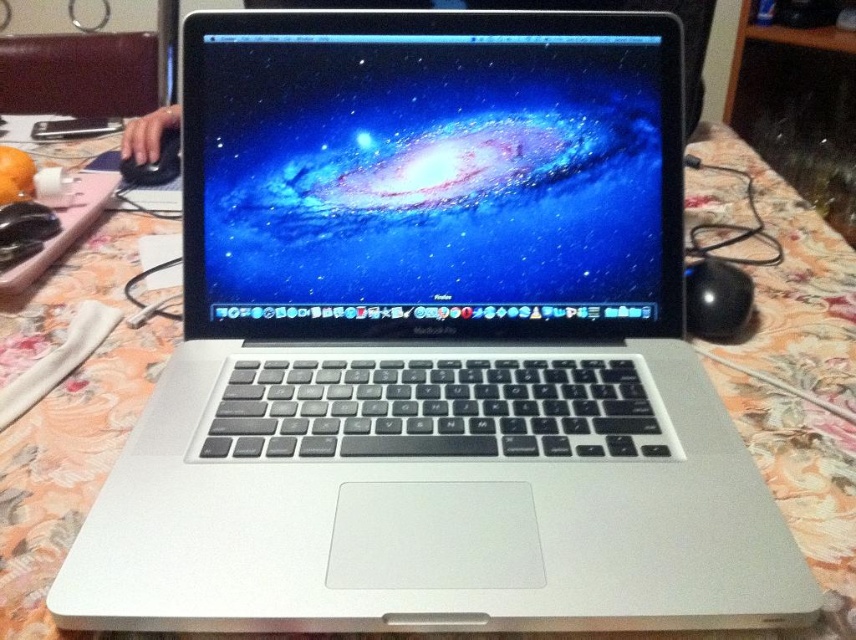
Which is more to the right, brown leather couch at upper left or black matte mouse at left?

black matte mouse at left is more to the right.

Is brown leather couch at upper left bigger than black matte mouse at left?

Indeed, brown leather couch at upper left has a larger size compared to black matte mouse at left.

At what (x,y) coordinates should I click in order to perform the action: click on brown leather couch at upper left. Please return your answer as a coordinate pair (x, y). The height and width of the screenshot is (640, 856). Looking at the image, I should click on (79, 74).